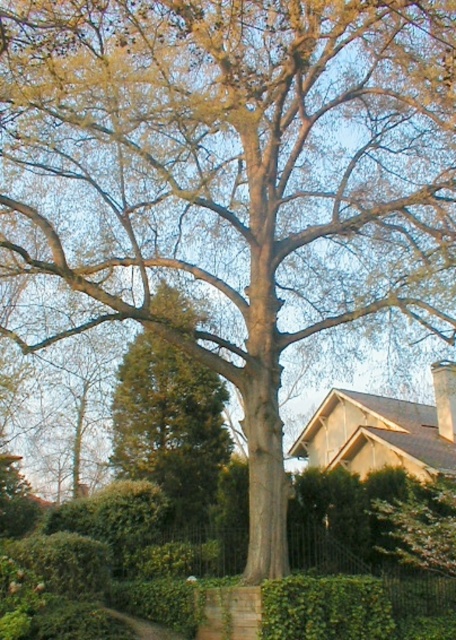
Does green leafy tree at center lie in front of green leafy hedge at lower center?

No, green leafy tree at center is behind green leafy hedge at lower center.

This screenshot has width=456, height=640. What do you see at coordinates (170, 424) in the screenshot?
I see `green leafy tree at center` at bounding box center [170, 424].

Locate an element on the screen. green leafy tree at center is located at coordinates (170, 424).